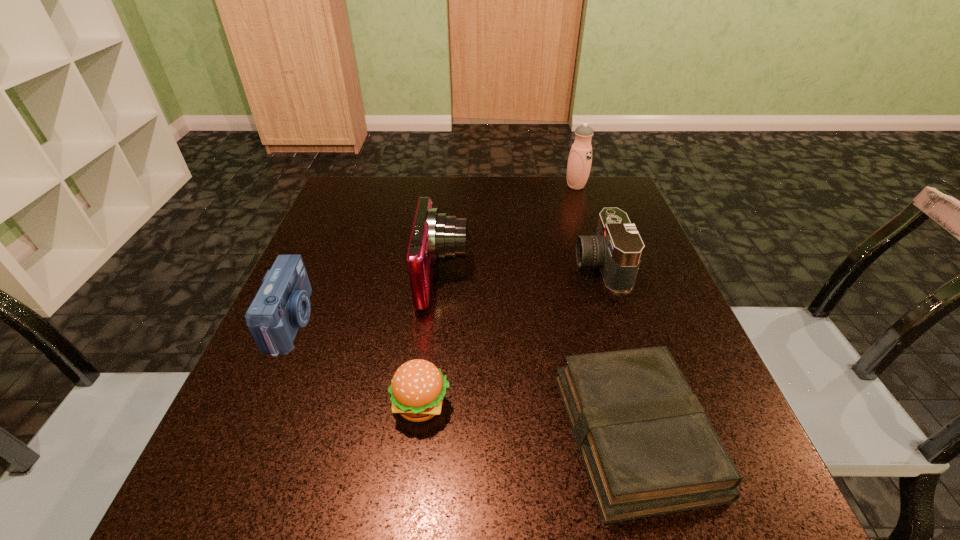
The height and width of the screenshot is (540, 960). Find the location of `vacant space located 0.190m on the front-facing side of the rightmost camera`. vacant space located 0.190m on the front-facing side of the rightmost camera is located at coordinates (488, 266).

Identify the location of vacant space located 0.250m on the front-facing side of the rightmost camera. (460, 266).

Where is `free space located 0.230m on the front-facing side of the rightmost camera`? free space located 0.230m on the front-facing side of the rightmost camera is located at coordinates (469, 266).

Where is `free space located on the lens of the leftmost camera`? free space located on the lens of the leftmost camera is located at coordinates pyautogui.click(x=444, y=322).

This screenshot has height=540, width=960. Find the location of `blank area located 0.090m on the left of the fifth tallest object`. blank area located 0.090m on the left of the fifth tallest object is located at coordinates point(335,405).

Locate an element on the screen. free space located 0.120m on the back of the shortest object is located at coordinates (601, 314).

You are a GUI agent. You are given a task and a screenshot of the screen. Output one action in this format:
    pyautogui.click(x=<x>, y=<y>)
    Task: Click on the object present at the far edge
    
    Given the screenshot: What is the action you would take?
    pyautogui.click(x=580, y=157)

You are a GUI agent. You are given a task and a screenshot of the screen. Output one action in this format:
    pyautogui.click(x=<x>, y=<y>)
    Task: Click on the object located at the near edge
    This screenshot has width=960, height=540.
    Given the screenshot: What is the action you would take?
    pyautogui.click(x=648, y=448)

Identify the location of object that is at the left edge. (282, 304).

Identify the location of thermos bottle at the right edge. (580, 157).